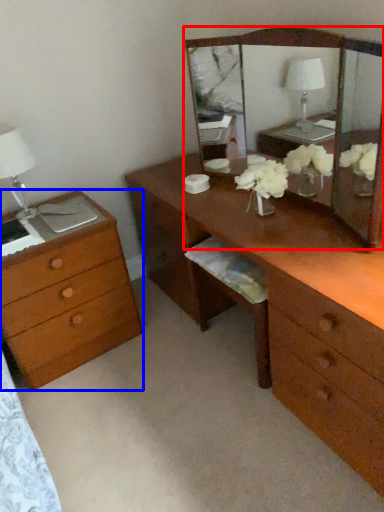
Question: Which object is further to the camera taking this photo, mirror (highlighted by a red box) or chest of drawers (highlighted by a blue box)?

Choices:
 (A) mirror
 (B) chest of drawers

Answer: (B)